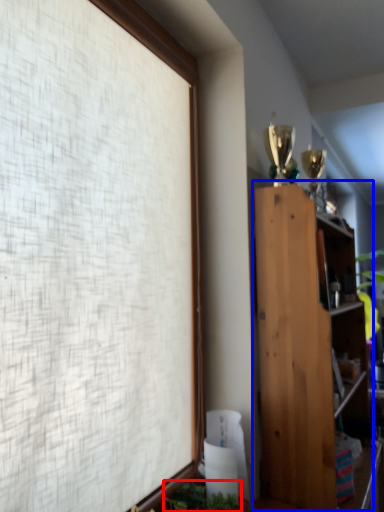
Question: Which object is closer to the camera taking this photo, plant (highlighted by a red box) or bookcase (highlighted by a blue box)?

Choices:
 (A) plant
 (B) bookcase

Answer: (A)